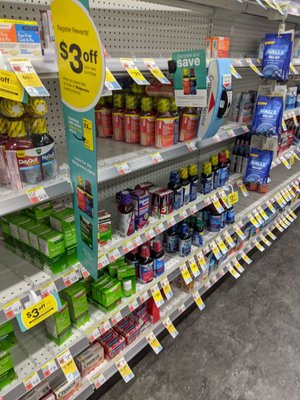
You are a GUI agent. You are given a task and a screenshot of the screen. Output one action in this format:
    pyautogui.click(x=<x>, y=<y>)
    Task: Click on the shelf
    
    Given the screenshot: What is the action you would take?
    pyautogui.click(x=140, y=46)